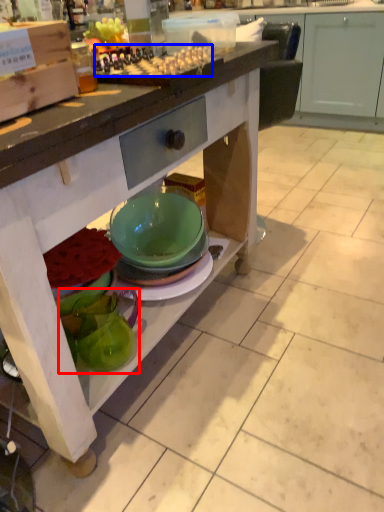
Question: Which point is closer to the camera, tableware (highlighted by a red box) or food (highlighted by a blue box)?

Choices:
 (A) tableware
 (B) food

Answer: (B)